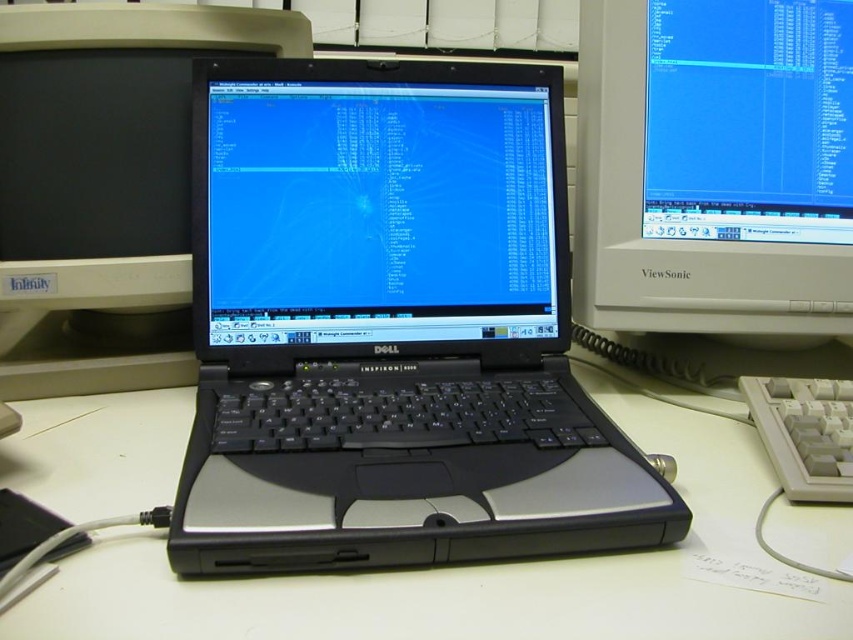
Does matte black screen at center have a greater height compared to matte black laptop at center?

Incorrect, matte black screen at center's height is not larger of matte black laptop at center's.

Is point (335, 307) more distant than point (91, 259)?

No, (335, 307) is closer to viewer.

Measure the distance between point (202, 186) and camera.

The distance of point (202, 186) from camera is 29.09 inches.

Where is `matte black screen at center`? This screenshot has width=853, height=640. matte black screen at center is located at coordinates (376, 204).

Is white plastic monitor at right bigger than matte black laptop at center?

No.

What do you see at coordinates (714, 166) in the screenshot? This screenshot has height=640, width=853. I see `white plastic monitor at right` at bounding box center [714, 166].

Locate an element on the screen. The height and width of the screenshot is (640, 853). white plastic monitor at right is located at coordinates (x=714, y=166).

Does white plastic monitor at right have a lesser width compared to white plastic keyboard at lower right?

Incorrect, white plastic monitor at right's width is not less than white plastic keyboard at lower right's.

At what (x,y) coordinates should I click in order to perform the action: click on white plastic monitor at right. Please return your answer as a coordinate pair (x, y). Looking at the image, I should click on (714, 166).

The image size is (853, 640). Find the location of `white plastic monitor at right`. white plastic monitor at right is located at coordinates (714, 166).